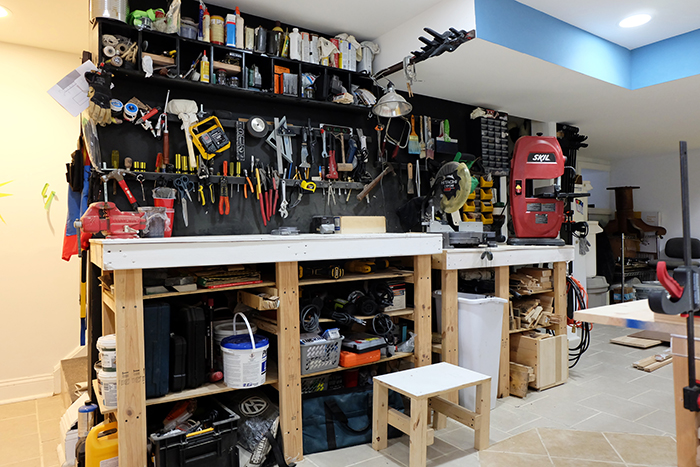
This screenshot has width=700, height=467. Identify the location of shelves. (248, 386).